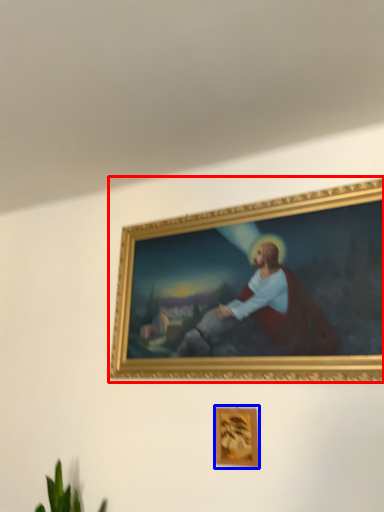
Question: Which of the following is the farthest to the observer, picture frame (highlighted by a red box) or picture frame (highlighted by a blue box)?

Choices:
 (A) picture frame
 (B) picture frame

Answer: (B)